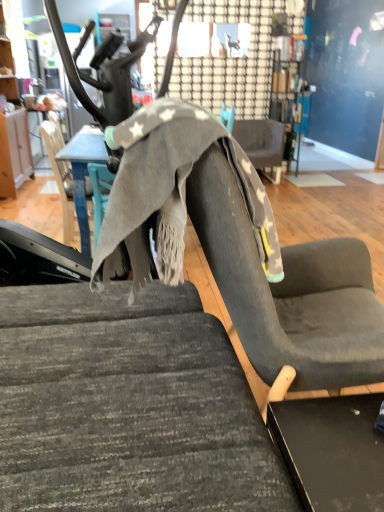
Measure the distance between wooden cabinet at left and camera.

4.03 meters.

What do you see at coordinates (83, 173) in the screenshot? This screenshot has height=512, width=384. I see `gray fabric table at center` at bounding box center [83, 173].

The height and width of the screenshot is (512, 384). What do you see at coordinates (128, 406) in the screenshot?
I see `textured gray fabric chair at center, arranged as the third chair when viewed from the back` at bounding box center [128, 406].

I want to click on textured gray fabric chair at center, which is the first chair in bottom-to-top order, so click(x=128, y=406).

Identify the location of gray fabric chair at center, which is the second chair from back to front. (75, 169).

Describe the element at coordinates (75, 169) in the screenshot. I see `gray fabric chair at center, which appears as the 1th chair when viewed from the left` at that location.

Find the location of a particular element. This screenshot has height=512, width=384. textured gray fabric swivel chair at center is located at coordinates (241, 250).

Where is `wooden cabinet at left`? The width and height of the screenshot is (384, 512). wooden cabinet at left is located at coordinates (12, 130).

Which of these two, gray fabric chair at center, which appears as the 3th chair when viewed from the left, or wooden cabinet at left, is thinner?

wooden cabinet at left is thinner.

Can you confirm if gray fabric chair at center, positioned as the third chair in bottom-to-top order, is positioned to the left of wooden cabinet at left?

No.

Who is bigger, gray fabric chair at center, positioned as the third chair in bottom-to-top order, or wooden cabinet at left?

wooden cabinet at left.

Is textured gray fabric chair at center, arranged as the third chair when viewed from the back, directly adjacent to wooden cabinet at left?

No, textured gray fabric chair at center, arranged as the third chair when viewed from the back, is not with wooden cabinet at left.

Is textured gray fabric chair at center, the second chair viewed from the left, spatially inside wooden cabinet at left, or outside of it?

textured gray fabric chair at center, the second chair viewed from the left, exists outside the volume of wooden cabinet at left.

Considering the sizes of objects textured gray fabric chair at center, marked as the second chair in a right-to-left arrangement, and wooden cabinet at left in the image provided, who is shorter, textured gray fabric chair at center, marked as the second chair in a right-to-left arrangement, or wooden cabinet at left?

With less height is textured gray fabric chair at center, marked as the second chair in a right-to-left arrangement.

Could you tell me if textured gray fabric chair at center, marked as the second chair in a right-to-left arrangement, is turned towards wooden cabinet at left?

No, textured gray fabric chair at center, marked as the second chair in a right-to-left arrangement, is not oriented towards wooden cabinet at left.

Is there a large distance between gray fabric chair at center, marked as the 2th chair in a front-to-back arrangement, and gray fabric chair at center, positioned as the third chair in bottom-to-top order?

Yes, gray fabric chair at center, marked as the 2th chair in a front-to-back arrangement, and gray fabric chair at center, positioned as the third chair in bottom-to-top order, are located far from each other.

What are the coordinates of `chair above the gray fabric chair at center, the second chair when ordered from top to bottom (from the image's perspective)` in the screenshot? It's located at (262, 144).

How many degrees apart are the facing directions of gray fabric chair at center, which appears as the 1th chair when viewed from the left, and gray fabric chair at center, which appears as the 3th chair when viewed from the left?

The facing directions of gray fabric chair at center, which appears as the 1th chair when viewed from the left, and gray fabric chair at center, which appears as the 3th chair when viewed from the left, are 91.1 degrees apart.

Can you confirm if gray fabric chair at center, the second chair when ordered from top to bottom, is wider than gray fabric chair at center, which appears as the 3th chair when viewed from the left?

Incorrect, the width of gray fabric chair at center, the second chair when ordered from top to bottom, does not surpass that of gray fabric chair at center, which appears as the 3th chair when viewed from the left.

From the image's perspective, which object appears higher, wooden cabinet at left or textured gray fabric chair at center, marked as the second chair in a right-to-left arrangement?

wooden cabinet at left is shown above in the image.

Is wooden cabinet at left bigger or smaller than textured gray fabric chair at center, arranged as the third chair when viewed from the back?

In the image, wooden cabinet at left appears to be smaller than textured gray fabric chair at center, arranged as the third chair when viewed from the back.

In the scene shown: In terms of height, does wooden cabinet at left look taller or shorter compared to textured gray fabric chair at center, arranged as the third chair when viewed from the back?

Clearly, wooden cabinet at left is taller compared to textured gray fabric chair at center, arranged as the third chair when viewed from the back.

Could you tell me if textured gray fabric swivel chair at center is turned towards gray fabric table at center?

No.

Is textured gray fabric swivel chair at center completely or partially outside of gray fabric table at center?

Yes, textured gray fabric swivel chair at center is located beyond the bounds of gray fabric table at center.

Based on their positions, is textured gray fabric swivel chair at center located to the left or right of gray fabric table at center?

Based on their positions, textured gray fabric swivel chair at center is located to the right of gray fabric table at center.

Is gray fabric chair at center, which is the second chair from back to front, next to textured gray fabric chair at center, which is the first chair in bottom-to-top order?

No, gray fabric chair at center, which is the second chair from back to front, is not in contact with textured gray fabric chair at center, which is the first chair in bottom-to-top order.

Is gray fabric chair at center, which is the second chair from back to front, surrounding textured gray fabric chair at center, arranged as the third chair when viewed from the back?

No, gray fabric chair at center, which is the second chair from back to front, does not contain textured gray fabric chair at center, arranged as the third chair when viewed from the back.

Starting from the gray fabric chair at center, which ranks as the third chair in right-to-left order, which chair is the 1st one to the right? Please provide its 2D coordinates.

[(128, 406)]

How distant is gray fabric chair at center, the second chair when ordered from top to bottom, from textured gray fabric chair at center, marked as the second chair in a right-to-left arrangement?

gray fabric chair at center, the second chair when ordered from top to bottom, is 4.53 feet away from textured gray fabric chair at center, marked as the second chair in a right-to-left arrangement.

Does gray fabric chair at center, which ranks as the first chair in right-to-left order, have a smaller size compared to textured gray fabric chair at center, which is the first chair in bottom-to-top order?

Yes, gray fabric chair at center, which ranks as the first chair in right-to-left order, is smaller than textured gray fabric chair at center, which is the first chair in bottom-to-top order.

Between gray fabric chair at center, which ranks as the first chair in right-to-left order, and textured gray fabric chair at center, the 3th chair viewed from the top, which one is positioned behind?

gray fabric chair at center, which ranks as the first chair in right-to-left order, is further away from the camera.

Who is taller, gray fabric chair at center, which ranks as the first chair in right-to-left order, or textured gray fabric chair at center, the 3th chair viewed from the top?

With more height is textured gray fabric chair at center, the 3th chair viewed from the top.

From a real-world perspective, which object stands above the other?

From a 3D spatial view, textured gray fabric chair at center, the first chair positioned from the front, is above.

What are the coordinates of `chair that is the 1st object located below the wooden cabinet at left (from the image's perspective)` in the screenshot? It's located at (262, 144).

What are the coordinates of `cabinetry behind the textured gray fabric chair at center, which is the first chair in bottom-to-top order` in the screenshot? It's located at (12, 130).

Looking at the image, which one is located closer to gray fabric chair at center, which ranks as the first chair in right-to-left order, textured gray fabric swivel chair at center or textured gray fabric chair at center, marked as the second chair in a right-to-left arrangement?

textured gray fabric swivel chair at center.

Looking at the image, which one is located closer to wooden cabinet at left, gray fabric table at center or textured gray fabric swivel chair at center?

Among the two, gray fabric table at center is located nearer to wooden cabinet at left.

Based on their spatial positions, is gray fabric chair at center, the second chair when ordered from top to bottom, or textured gray fabric chair at center, the first chair positioned from the front, closer to textured gray fabric swivel chair at center?

textured gray fabric chair at center, the first chair positioned from the front, is closer to textured gray fabric swivel chair at center.

Estimate the real-world distances between objects in this image. Which object is further from gray fabric chair at center, which appears as the 3th chair when viewed from the left, gray fabric chair at center, which is the second chair from back to front, or wooden cabinet at left?

gray fabric chair at center, which is the second chair from back to front, is further to gray fabric chair at center, which appears as the 3th chair when viewed from the left.

Based on the photo, considering their positions, is wooden cabinet at left positioned further to textured gray fabric swivel chair at center than gray fabric table at center?

wooden cabinet at left.

Considering their positions, is wooden cabinet at left positioned further to textured gray fabric chair at center, the second chair viewed from the left, than gray fabric table at center?

The object further to textured gray fabric chair at center, the second chair viewed from the left, is wooden cabinet at left.

When comparing their distances from gray fabric chair at center, acting as the first chair starting from the top, does gray fabric table at center or gray fabric chair at center, which is the second chair from back to front, seem closer?

gray fabric chair at center, which is the second chair from back to front, is positioned closer to the anchor gray fabric chair at center, acting as the first chair starting from the top.

From the image, which object appears to be farther from gray fabric chair at center, marked as the 2th chair in a front-to-back arrangement, gray fabric table at center or textured gray fabric chair at center, which is the first chair in bottom-to-top order?

A: textured gray fabric chair at center, which is the first chair in bottom-to-top order.

Locate an element on the screen. The image size is (384, 512). cabinetry between gray fabric table at center and gray fabric chair at center, which ranks as the first chair in right-to-left order, in the front-back direction is located at coordinates (12, 130).

Where is `chair between gray fabric table at center and wooden cabinet at left along the z-axis`? Image resolution: width=384 pixels, height=512 pixels. chair between gray fabric table at center and wooden cabinet at left along the z-axis is located at coordinates (75, 169).

This screenshot has height=512, width=384. I want to click on swivel chair between textured gray fabric chair at center, the first chair positioned from the front, and wooden cabinet at left, along the z-axis, so click(x=241, y=250).

Where is `chair between textured gray fabric swivel chair at center and wooden cabinet at left from front to back`? chair between textured gray fabric swivel chair at center and wooden cabinet at left from front to back is located at coordinates (75, 169).